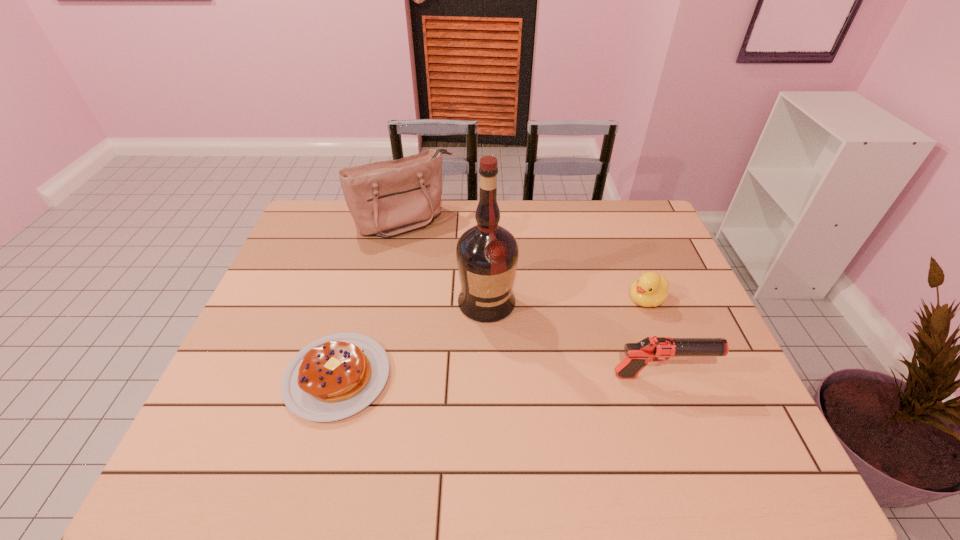
Identify the location of the shortest object. (334, 377).

The image size is (960, 540). Find the location of `gun`. gun is located at coordinates (649, 349).

You are a GUI agent. You are given a task and a screenshot of the screen. Output one action in this format:
    pyautogui.click(x=<x>, y=<y>)
    Task: Click on the liquor
    The height and width of the screenshot is (540, 960).
    Given the screenshot: What is the action you would take?
    pyautogui.click(x=487, y=254)

In order to click on the tallest object in this screenshot , I will do `click(487, 254)`.

In order to click on duckling in this screenshot , I will do `click(651, 289)`.

The height and width of the screenshot is (540, 960). Find the location of `shoulder bag`. shoulder bag is located at coordinates (387, 198).

The width and height of the screenshot is (960, 540). What are the coordinates of `the fourth shortest object` in the screenshot? It's located at (387, 198).

At what (x,y) coordinates should I click in order to perform the action: click on free space located on the back of the pancake. Please return your answer as a coordinate pair (x, y). This screenshot has height=540, width=960. Looking at the image, I should click on (364, 284).

You are a GUI agent. You are given a task and a screenshot of the screen. Output one action in this format:
    pyautogui.click(x=<x>, y=<y>)
    Task: Click on the vacant point located at the aiming end of the third tallest object
    The width and height of the screenshot is (960, 540).
    Given the screenshot: What is the action you would take?
    pyautogui.click(x=729, y=376)

Image resolution: width=960 pixels, height=540 pixels. Find the location of `vacant space positioned on the surface of the third object from right to left`. vacant space positioned on the surface of the third object from right to left is located at coordinates (521, 369).